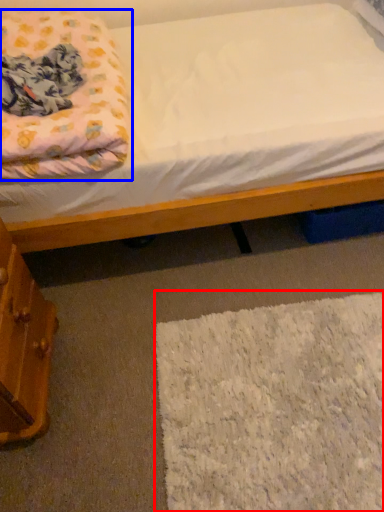
Question: Which object appears farthest to the camera in this image, mat (highlighted by a red box) or blanket (highlighted by a blue box)?

Choices:
 (A) mat
 (B) blanket

Answer: (A)